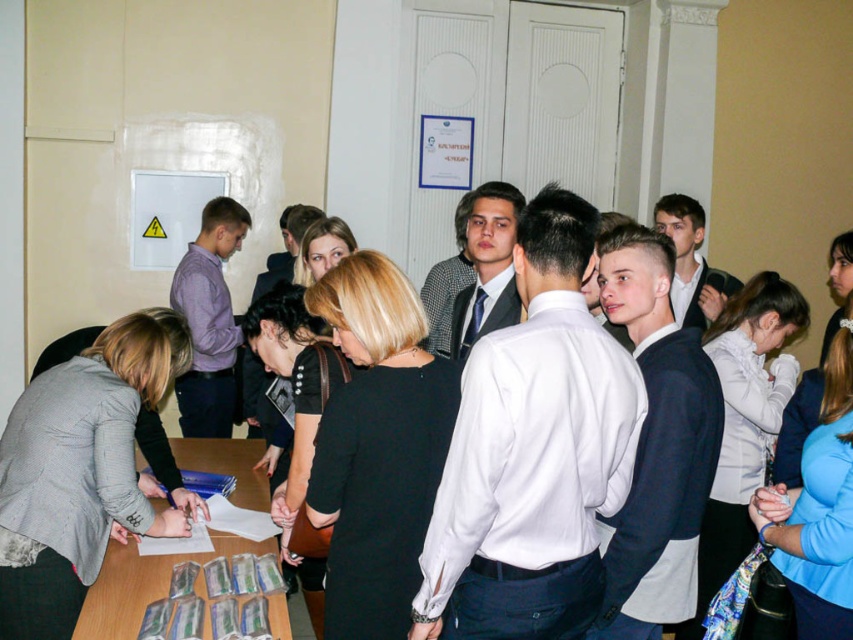
Identify the location of gray fabric jacket at lower left. (79, 472).

Who is taller, gray fabric jacket at lower left or wooden table at lower left?

gray fabric jacket at lower left is taller.

Between point (6, 502) and point (238, 461), which one is positioned in front?

Point (6, 502)

You are a GUI agent. You are given a task and a screenshot of the screen. Output one action in this format:
    pyautogui.click(x=<x>, y=<y>)
    Task: Click on the gray fabric jacket at lower left
    The image size is (853, 640).
    Given the screenshot: What is the action you would take?
    pyautogui.click(x=79, y=472)